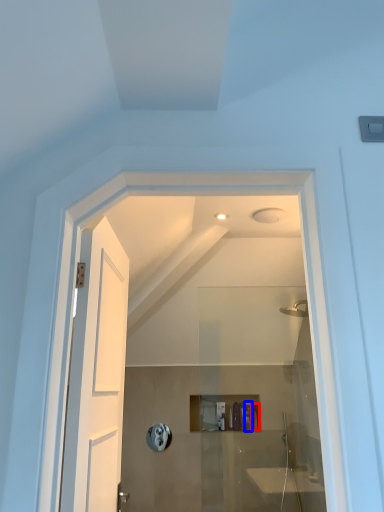
Question: Which of the following is the farthest to the observer, toiletry (highlighted by a red box) or toiletry (highlighted by a blue box)?

Choices:
 (A) toiletry
 (B) toiletry

Answer: (A)